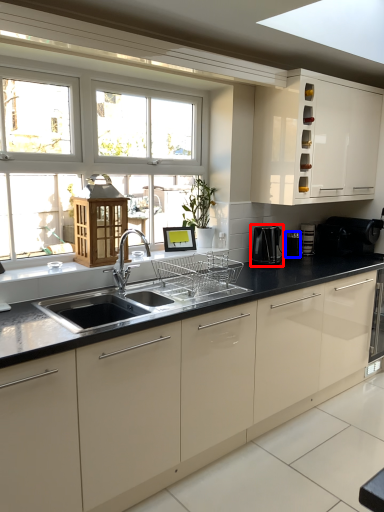
Question: Which of the following is the farthest to the observer, coffee machine (highlighted by a red box) or appliance (highlighted by a blue box)?

Choices:
 (A) coffee machine
 (B) appliance

Answer: (B)